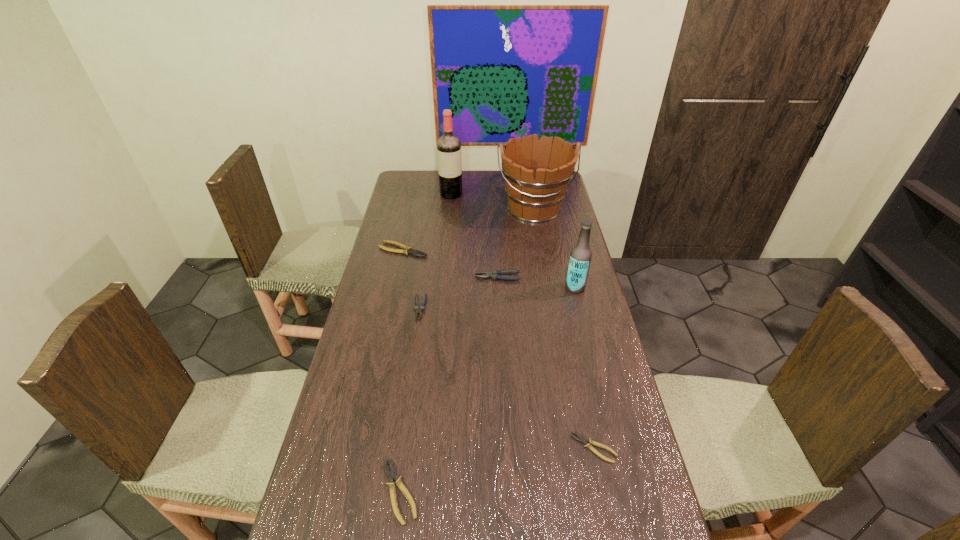
The height and width of the screenshot is (540, 960). I want to click on the third shortest object, so click(391, 474).

The image size is (960, 540). Find the location of `the rightmost pliers`. the rightmost pliers is located at coordinates (588, 443).

You are a GUI agent. You are given a task and a screenshot of the screen. Output one action in this format:
    pyautogui.click(x=<x>, y=<y>)
    Task: Click on the smallest yellow pliers
    Image resolution: width=960 pixels, height=540 pixels.
    Given the screenshot: What is the action you would take?
    pyautogui.click(x=588, y=443)

Find the location of a particular element. free space located 0.390m on the front-facing side of the liquor is located at coordinates (445, 251).

Locate an element on the screen. Image resolution: width=960 pixels, height=540 pixels. free space located with the handle on the wine bucket is located at coordinates (539, 242).

I want to click on free region located 0.050m on the side of the beer bottle with the label, so click(x=552, y=287).

You are a GUI agent. You are given a task and a screenshot of the screen. Output one action in this format:
    pyautogui.click(x=<x>, y=<y>)
    Task: Click on the free space located on the side of the beer bottle with the label
    
    Given the screenshot: What is the action you would take?
    (x=518, y=287)

You are a GUI agent. You are given a task and a screenshot of the screen. Output one action in this format:
    pyautogui.click(x=<x>, y=<y>)
    Task: Click on the vacant space located 0.230m on the side of the beer bottle with the label
    This screenshot has height=540, width=960.
    Given the screenshot: What is the action you would take?
    pyautogui.click(x=502, y=287)

The width and height of the screenshot is (960, 540). Find the location of `free region located 0.350m at the gripping part of the bigger gray pliers`. free region located 0.350m at the gripping part of the bigger gray pliers is located at coordinates (382, 277).

The height and width of the screenshot is (540, 960). Find the location of `vacant area located 0.330m at the gripping part of the bigger gray pliers`. vacant area located 0.330m at the gripping part of the bigger gray pliers is located at coordinates (388, 277).